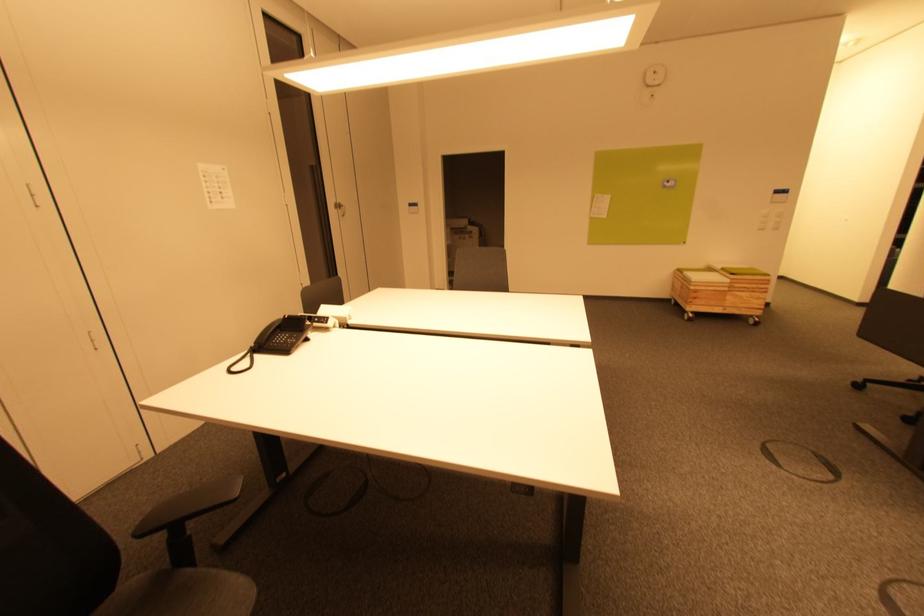
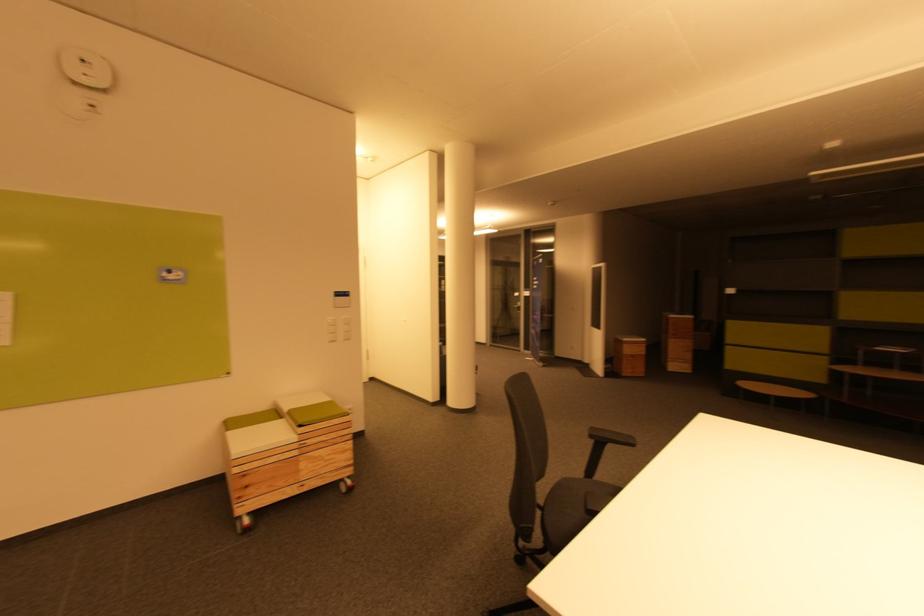
In the second image, find the point that corresponds to point (737, 274) in the first image.

(305, 424)